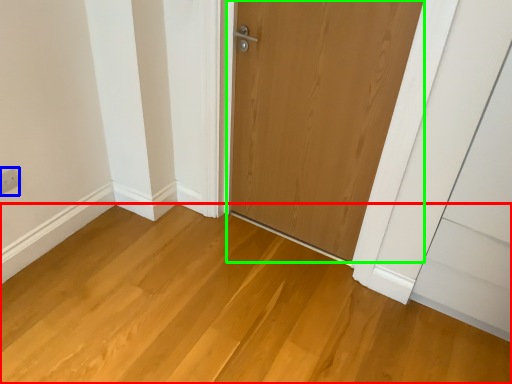
Question: Which object is positioned farthest from plain (highlighted by a red box)? Select from electric outlet (highlighted by a blue box) and door (highlighted by a green box).

Choices:
 (A) electric outlet
 (B) door

Answer: (A)